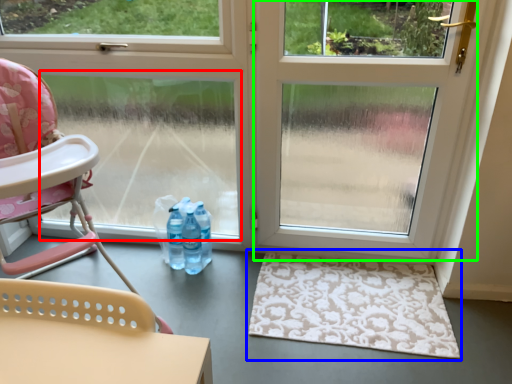
Question: Based on their relative distances, which object is nearer to window screen (highlighted by a red box)? Choose from doormat (highlighted by a blue box) and screen door (highlighted by a green box).

Choices:
 (A) doormat
 (B) screen door

Answer: (B)